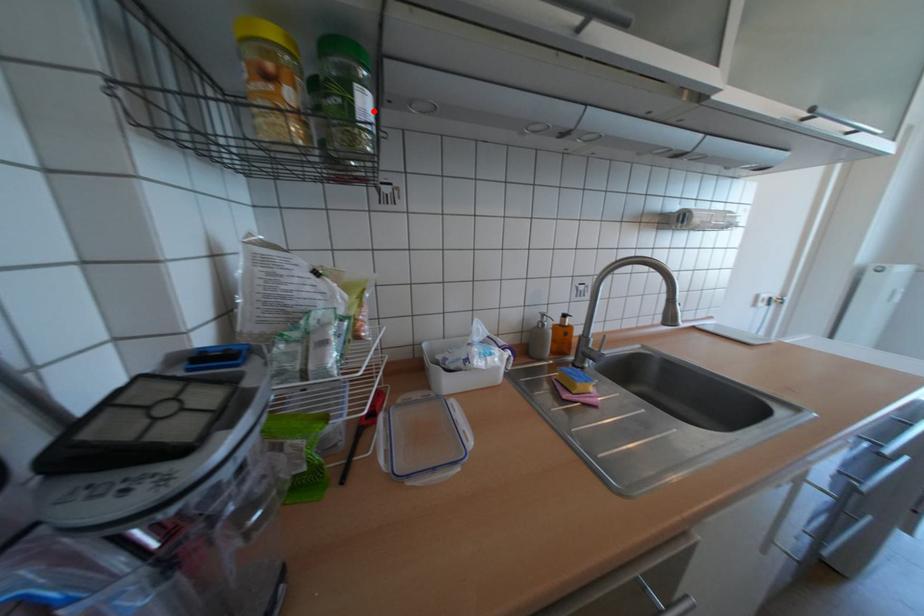
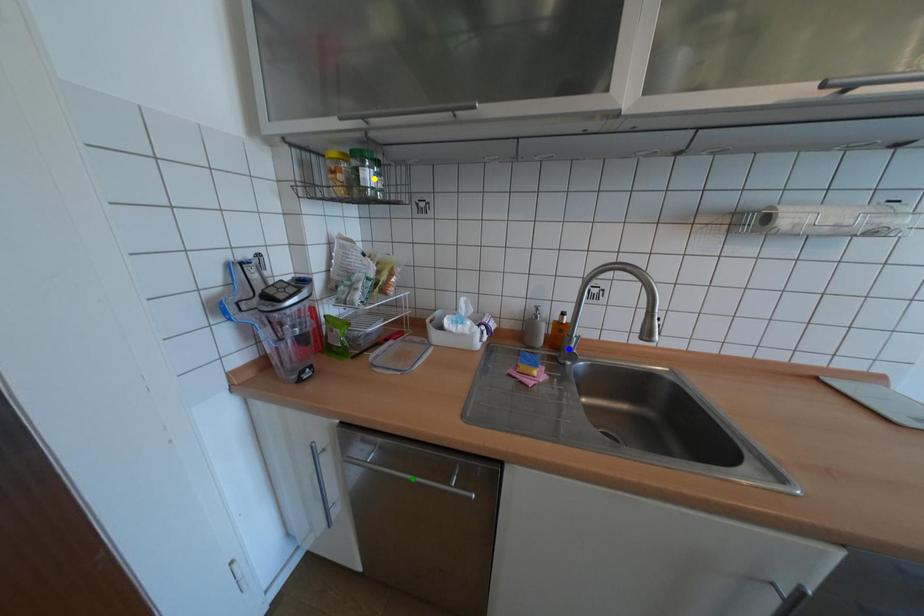
Question: I am providing you with two images of the same scene from different viewpoints. A red point is marked on the first image. You are given multiple points on the second image. Which spot in image 2 lines up with the point in image 1?

Choices:
 (A) green point
 (B) yellow point
 (C) blue point

Answer: (B)